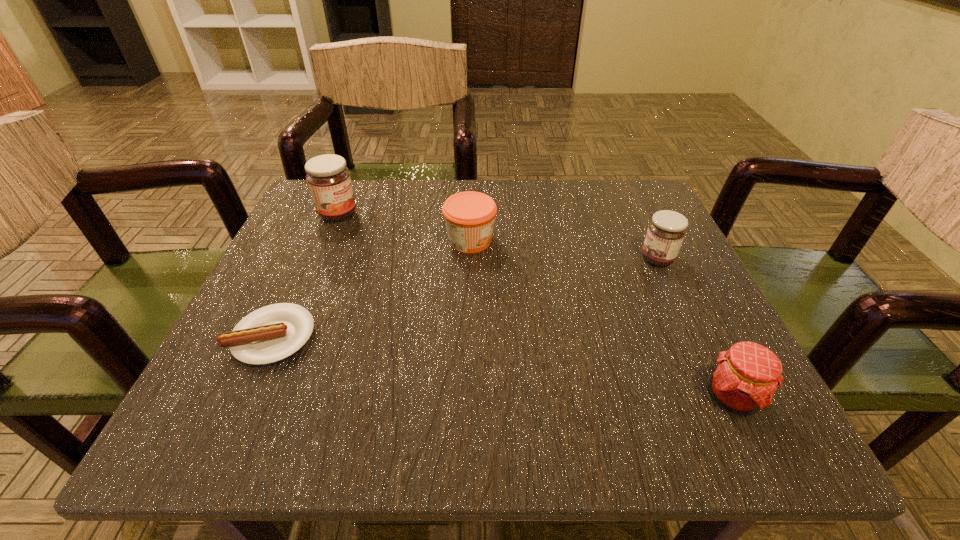
Where is `the tallest jam`? This screenshot has width=960, height=540. the tallest jam is located at coordinates point(329,181).

Find the location of a particular element. The width and height of the screenshot is (960, 540). the leftmost jam is located at coordinates (329, 181).

Image resolution: width=960 pixels, height=540 pixels. Identify the location of the second jam from left to right. (469, 216).

This screenshot has height=540, width=960. In order to click on the nearest object in this screenshot , I will do `click(745, 378)`.

The width and height of the screenshot is (960, 540). I want to click on the second nearest object, so click(x=272, y=333).

What are the coordinates of `sausage` in the screenshot? It's located at (272, 333).

Locate an element on the screen. vacant space situated on the right of the leftmost jam is located at coordinates (548, 214).

You are a GUI agent. You are given a task and a screenshot of the screen. Output one action in this format:
    pyautogui.click(x=<x>, y=<y>)
    Task: Click on the free space located on the front label of the third jam from right to left
    
    Given the screenshot: What is the action you would take?
    pyautogui.click(x=564, y=241)

At what (x,y) coordinates should I click in order to perform the action: click on free region located 0.100m on the back of the nearest object. Please return your answer as a coordinate pair (x, y). Image resolution: width=960 pixels, height=540 pixels. Looking at the image, I should click on (695, 320).

The width and height of the screenshot is (960, 540). In order to click on blank space located on the back of the second nearest object in this screenshot , I will do `click(305, 265)`.